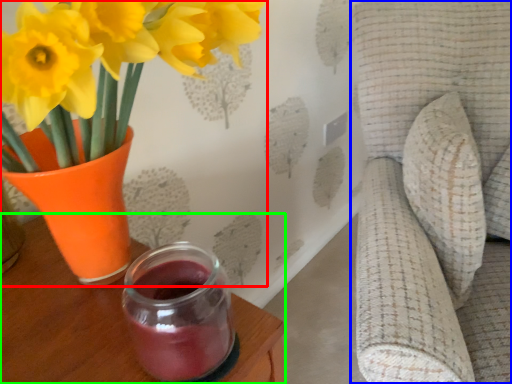
Question: Which object is positioned farthest from houseplant (highlighted by a red box)? Select from swivel chair (highlighted by a blue box) and table (highlighted by a green box).

Choices:
 (A) swivel chair
 (B) table

Answer: (A)